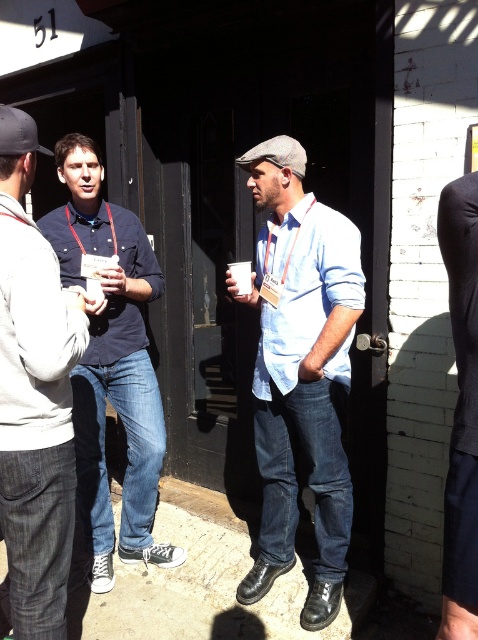
Based on the coordinates provided, what item is located at point (301, 371) in the image?

The point (301, 371) indicates light blue denim jeans at center.